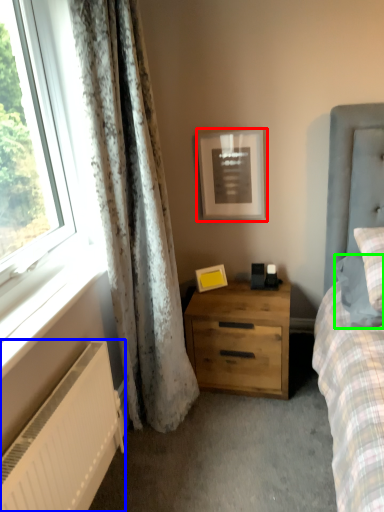
Question: Estimate the real-world distances between objects in this image. Which object is farther from picture frame (highlighted by a red box), radiator (highlighted by a blue box) or pillow (highlighted by a green box)?

Choices:
 (A) radiator
 (B) pillow

Answer: (A)